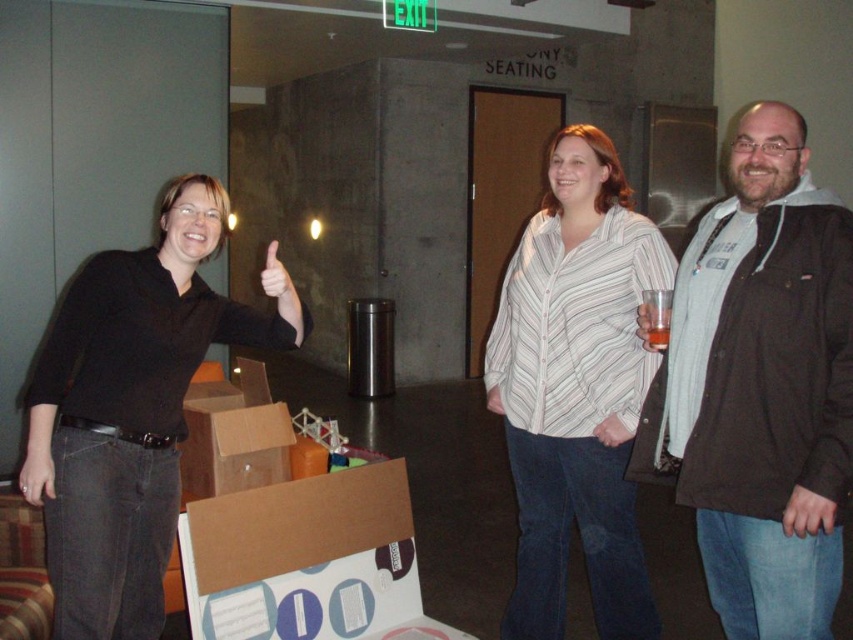
Who is lower down, black matte shirt at left or white striped shirt at center?

black matte shirt at left is below.

From the picture: Can you confirm if black matte shirt at left is positioned below white striped shirt at center?

Yes, black matte shirt at left is below white striped shirt at center.

Which is behind, point (201, 278) or point (624, 454)?

Point (201, 278)

At what (x,y) coordinates should I click in order to perform the action: click on black matte shirt at left. Please return your answer as a coordinate pair (x, y). The height and width of the screenshot is (640, 853). Looking at the image, I should click on (132, 410).

Which of these two, white striped shirt at center or translucent plastic cup at right, stands shorter?

translucent plastic cup at right

In order to click on white striped shirt at center in this screenshot , I will do `click(576, 388)`.

Locate an element on the screen. This screenshot has width=853, height=640. white striped shirt at center is located at coordinates (576, 388).

Between black matte shirt at left and translucent plastic cup at right, which one appears on the left side from the viewer's perspective?

black matte shirt at left

Is black matte shirt at left wider than translucent plastic cup at right?

Indeed, black matte shirt at left has a greater width compared to translucent plastic cup at right.

Describe the element at coordinates (132, 410) in the screenshot. I see `black matte shirt at left` at that location.

Find the location of a particular element. This screenshot has width=853, height=640. black matte shirt at left is located at coordinates (132, 410).